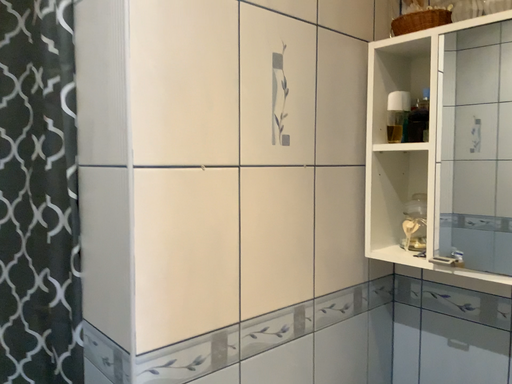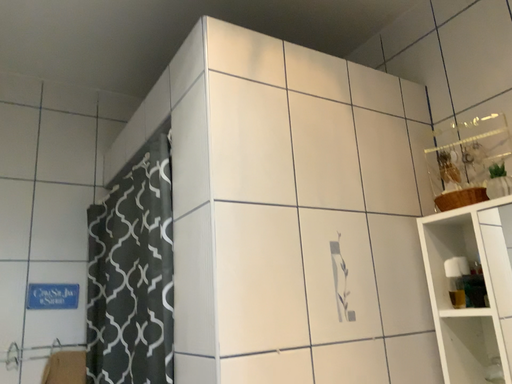
Question: How did the camera likely rotate when shooting the video?

Choices:
 (A) rotated right
 (B) rotated left

Answer: (B)